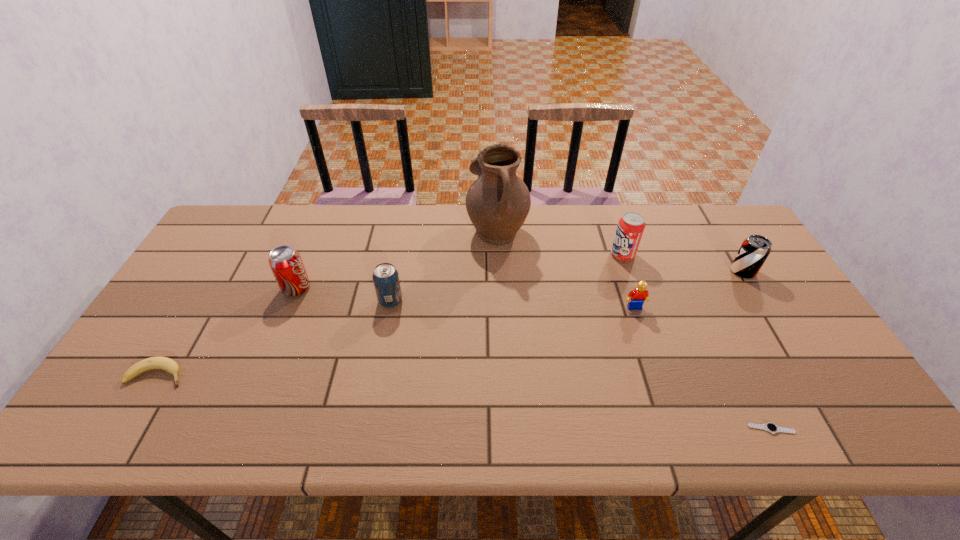
Identify the location of free space located on the front-facing side of the sixth tallest object. click(650, 356).

Locate an element on the screen. vacant space located at the stem of the second nearest object is located at coordinates (333, 375).

Locate an element on the screen. The image size is (960, 540). free space located on the back of the shortest object is located at coordinates (728, 340).

Image resolution: width=960 pixels, height=540 pixels. What are the coordinates of `pitcher that is at the far edge` in the screenshot? It's located at (498, 202).

Where is `soda can present at the far edge`? The height and width of the screenshot is (540, 960). soda can present at the far edge is located at coordinates (630, 228).

Where is `object present at the near edge`? This screenshot has width=960, height=540. object present at the near edge is located at coordinates (770, 427).

Where is `object at the left edge`? The height and width of the screenshot is (540, 960). object at the left edge is located at coordinates pos(164,363).

Locate an element on the screen. The height and width of the screenshot is (540, 960). object that is at the right edge is located at coordinates (752, 254).

The height and width of the screenshot is (540, 960). I want to click on free space at the far edge, so click(x=616, y=224).

You are a GUI agent. You are given a task and a screenshot of the screen. Output one action in this format:
    pyautogui.click(x=<x>, y=<y>)
    Task: Click on the vacant space at the near edge of the desktop
    The width and height of the screenshot is (960, 540).
    Given the screenshot: What is the action you would take?
    pyautogui.click(x=746, y=410)